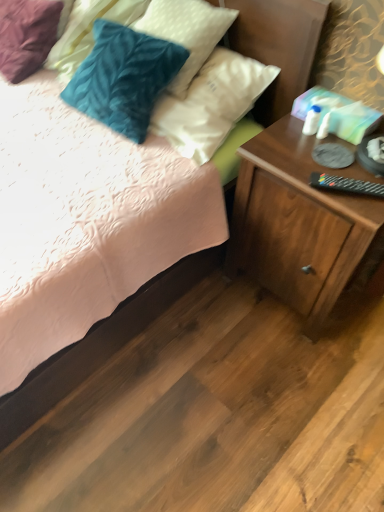
Where is `vacant area to the left of wooden nightstand at lower right`? This screenshot has width=384, height=512. vacant area to the left of wooden nightstand at lower right is located at coordinates (198, 314).